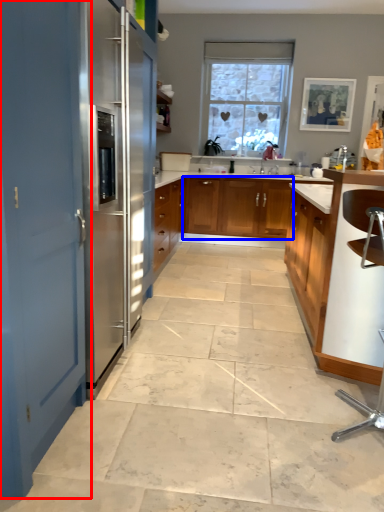
Question: Which of the following is the farthest to the observer, door (highlighted by a red box) or cabinetry (highlighted by a blue box)?

Choices:
 (A) door
 (B) cabinetry

Answer: (B)